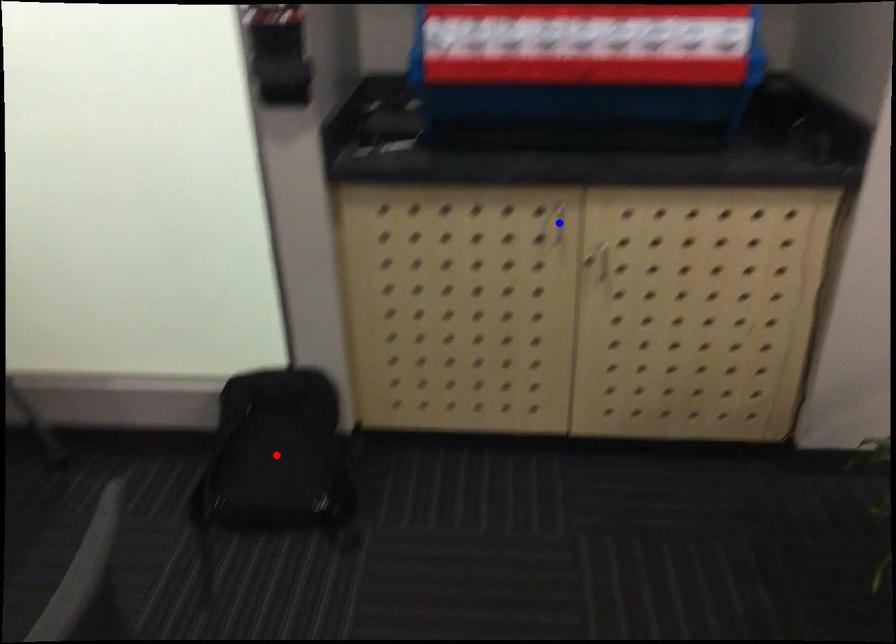
Question: Two points are marked on the image. Which point is closer to the camera?

Choices:
 (A) Blue point is closer.
 (B) Red point is closer.

Answer: (A)